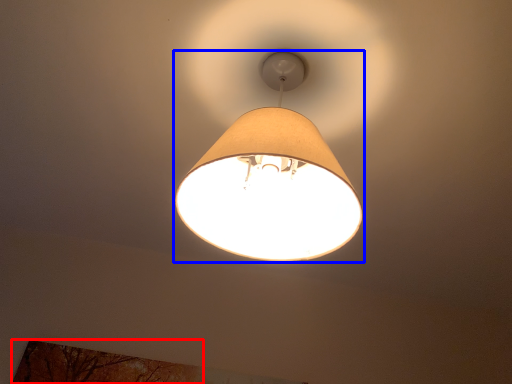
Question: Which object appears farthest to the camera in this image, tree (highlighted by a red box) or lamp (highlighted by a blue box)?

Choices:
 (A) tree
 (B) lamp

Answer: (A)